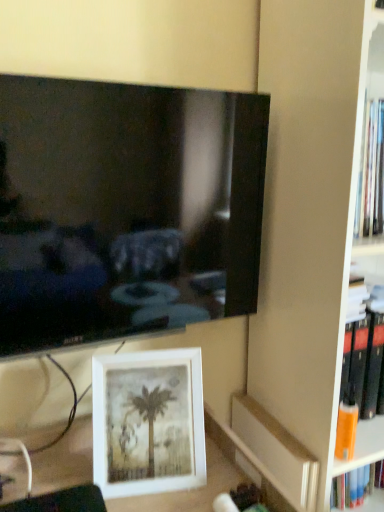
Question: From a real-world perspective, is white matte picture frame at lower center located beneath matte black bookshelf at right?

Choices:
 (A) no
 (B) yes

Answer: (B)

Question: From the image's perspective, is white matte picture frame at lower center over matte black bookshelf at right?

Choices:
 (A) no
 (B) yes

Answer: (A)

Question: Does white matte picture frame at lower center have a greater width compared to matte black bookshelf at right?

Choices:
 (A) no
 (B) yes

Answer: (A)

Question: Considering the relative positions of white matte picture frame at lower center and matte black bookshelf at right in the image provided, is white matte picture frame at lower center to the right of matte black bookshelf at right from the viewer's perspective?

Choices:
 (A) no
 (B) yes

Answer: (A)

Question: Considering the relative sizes of white matte picture frame at lower center and matte black bookshelf at right in the image provided, is white matte picture frame at lower center smaller than matte black bookshelf at right?

Choices:
 (A) yes
 (B) no

Answer: (A)

Question: Would you say white matte picture frame at lower center is to the left or to the right of black glossy tv at upper left in the picture?

Choices:
 (A) right
 (B) left

Answer: (A)

Question: Is white matte picture frame at lower center wider or thinner than black glossy tv at upper left?

Choices:
 (A) thin
 (B) wide

Answer: (B)

Question: Is white matte picture frame at lower center taller or shorter than black glossy tv at upper left?

Choices:
 (A) tall
 (B) short

Answer: (B)

Question: Choose the correct answer: Is white matte picture frame at lower center inside black glossy tv at upper left or outside it?

Choices:
 (A) inside
 (B) outside

Answer: (B)

Question: From the image's perspective, is white matte picture frame at lower center located above or below matte black bookshelf at right?

Choices:
 (A) above
 (B) below

Answer: (B)

Question: Is point (97, 400) positioned closer to the camera than point (332, 275)?

Choices:
 (A) farther
 (B) closer

Answer: (A)

Question: Looking at the image, does white matte picture frame at lower center seem bigger or smaller compared to matte black bookshelf at right?

Choices:
 (A) small
 (B) big

Answer: (A)

Question: Is white matte picture frame at lower center in front of or behind matte black bookshelf at right in the image?

Choices:
 (A) front
 (B) behind

Answer: (B)

Question: Does point (264, 152) appear closer or farther from the camera than point (312, 489)?

Choices:
 (A) farther
 (B) closer

Answer: (A)

Question: In the image, is black glossy tv at upper left positioned in front of or behind orange matte paperback book at lower right?

Choices:
 (A) behind
 (B) front

Answer: (B)